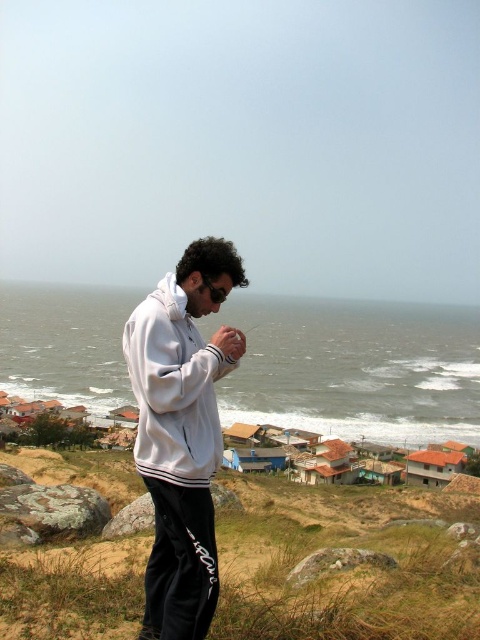
Does white matte jacket at center have a greater height compared to white fleece sweatshirt at center?

Yes, white matte jacket at center is taller than white fleece sweatshirt at center.

Between white matte jacket at center and white fleece sweatshirt at center, which one has less height?

white fleece sweatshirt at center

The image size is (480, 640). In order to click on white matte jacket at center in this screenshot , I will do `click(180, 435)`.

Is white matte jacket at center below matte white hand at center?

Indeed, white matte jacket at center is positioned under matte white hand at center.

Can you confirm if white matte jacket at center is taller than matte white hand at center?

Yes.

Is point (146, 404) positioned behind point (233, 356)?

No, it is in front of (233, 356).

Where is `white matte jacket at center`? This screenshot has height=640, width=480. white matte jacket at center is located at coordinates (180, 435).

Can you confirm if white fleece sweatshirt at center is positioned above matte white hand at center?

Actually, white fleece sweatshirt at center is below matte white hand at center.

From the picture: Is white fleece sweatshirt at center smaller than matte white hand at center?

Incorrect, white fleece sweatshirt at center is not smaller in size than matte white hand at center.

Find the location of `white fleece sweatshirt at center`. white fleece sweatshirt at center is located at coordinates (173, 388).

Find the location of `white fleece sweatshirt at center`. white fleece sweatshirt at center is located at coordinates (173, 388).